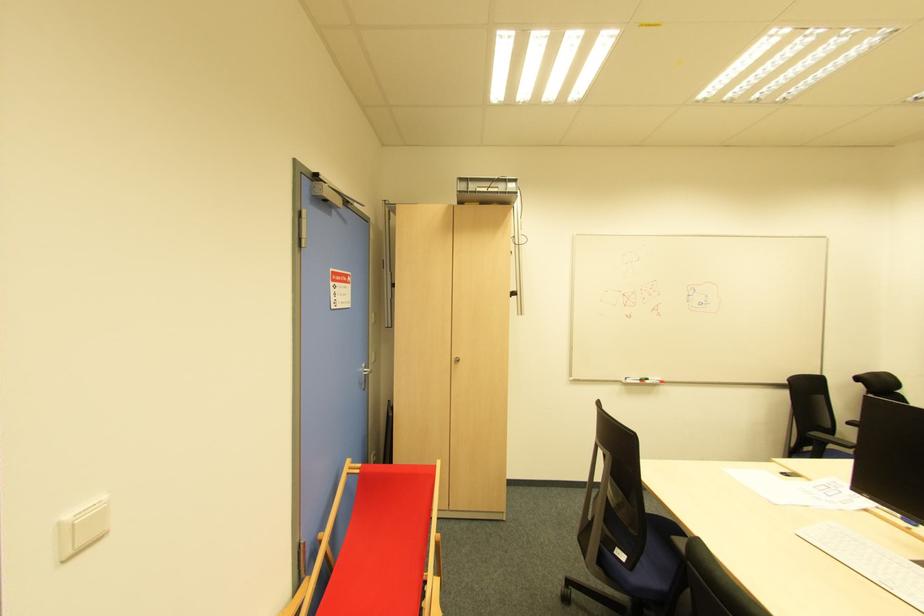
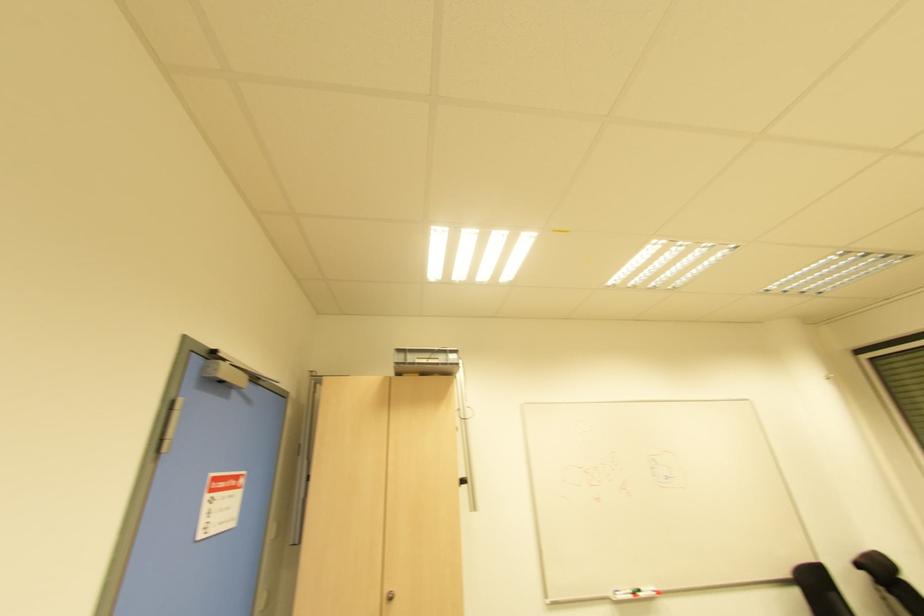
Question: How did the camera likely rotate?

Choices:
 (A) Left
 (B) Right
 (C) Up
 (D) Down

Answer: (C)